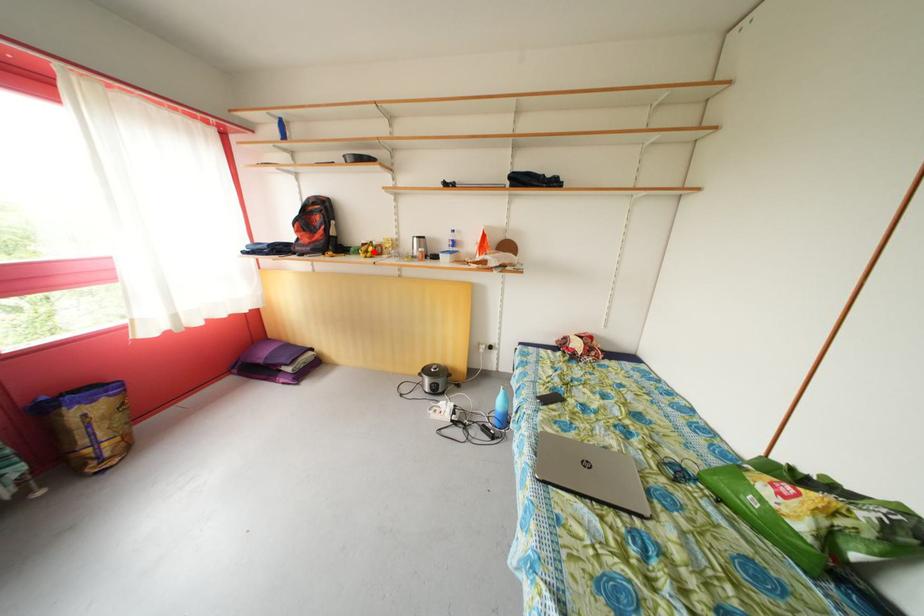
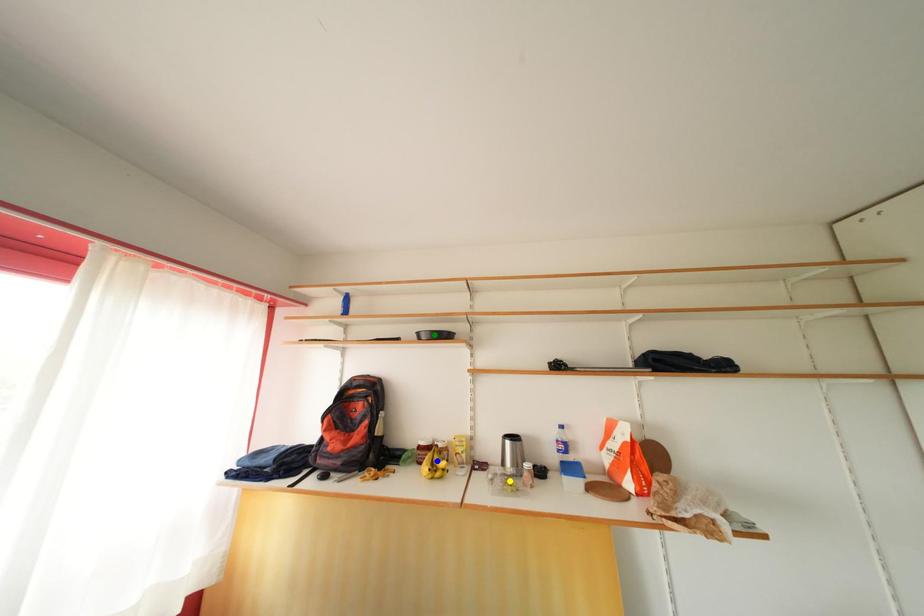
Question: I am providing you with two images of the same scene from different viewpoints. A red point is marked on the first image. You are given multiple points on the second image. Which point in image 2 represents the same 3d spot as the red point in image 1?

Choices:
 (A) green point
 (B) yellow point
 (C) blue point

Answer: (C)